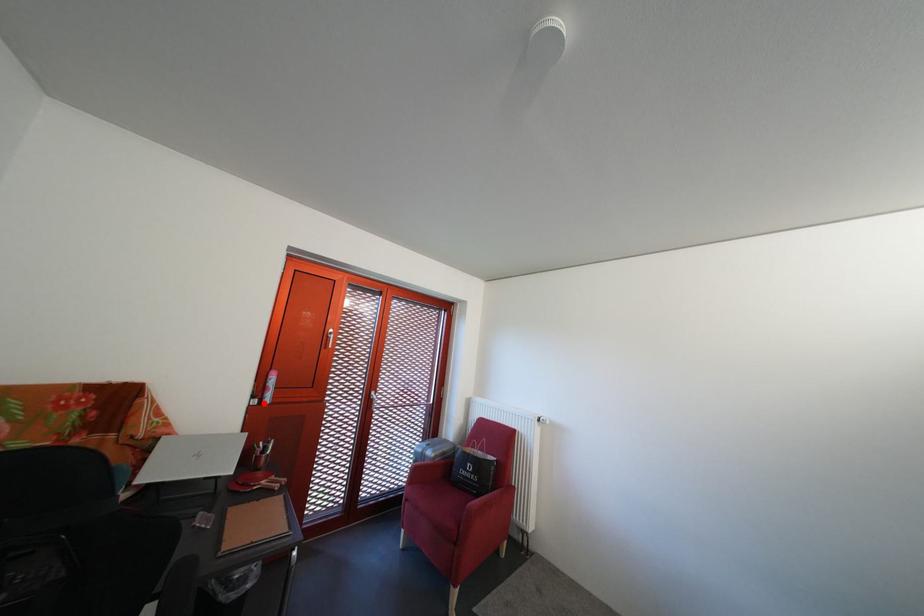
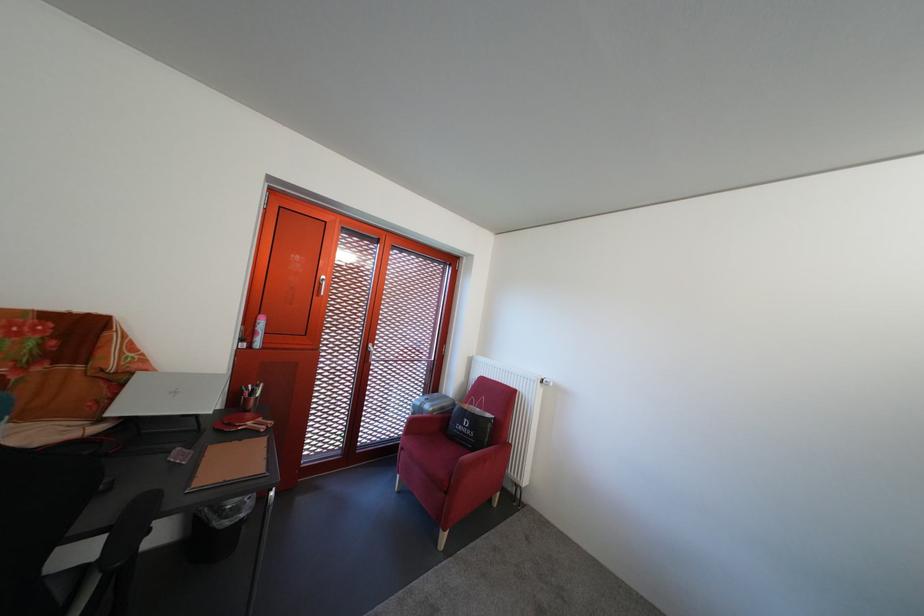
Find the pixel in the second image that matches the highlighted location in the first image.

(252, 346)